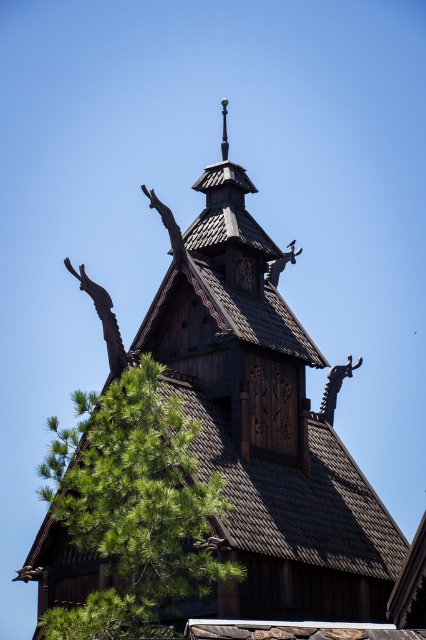
Which is more to the right, green leafy tree at lower left or brown wooden roof at center?

From the viewer's perspective, brown wooden roof at center appears more on the right side.

Is green leafy tree at lower left to the right of brown wooden roof at center from the viewer's perspective?

In fact, green leafy tree at lower left is to the left of brown wooden roof at center.

Where is `green leafy tree at lower left`? Image resolution: width=426 pixels, height=640 pixels. green leafy tree at lower left is located at coordinates (132, 506).